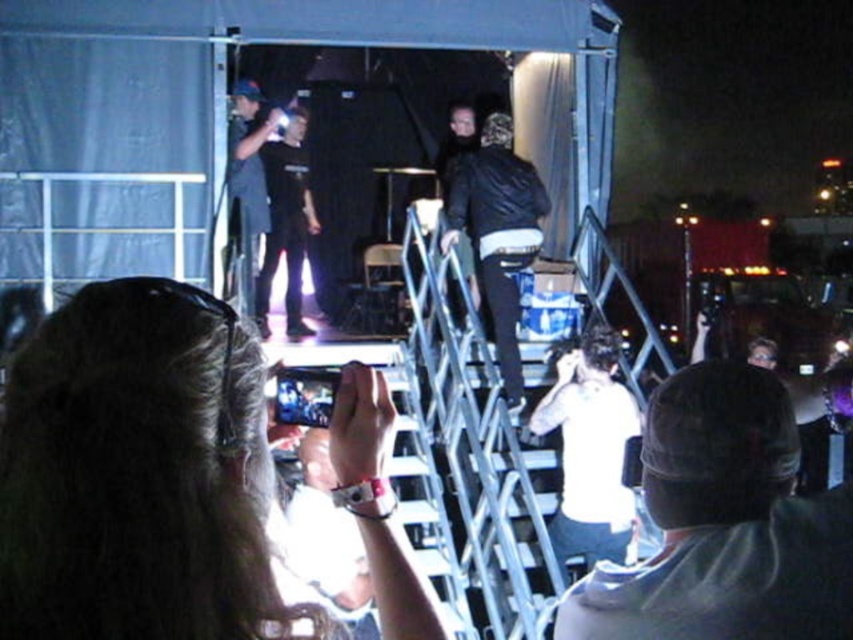
Question: Is gray fabric cap at upper right to the left of dark blue jeans at upper center from the viewer's perspective?

Choices:
 (A) no
 (B) yes

Answer: (A)

Question: Considering the real-world distances, which object is closest to the white matte shirt at center?

Choices:
 (A) dark blue jeans at upper center
 (B) silver metallic ladder at center
 (C) gray fabric cap at upper right
 (D) black leather jacket at center

Answer: (B)

Question: Where is silver metallic ladder at center located in relation to dark blue jeans at upper center in the image?

Choices:
 (A) left
 (B) right

Answer: (B)

Question: Is gray fabric cap at upper right below white matte shirt at center?

Choices:
 (A) no
 (B) yes

Answer: (A)

Question: Which object appears closest to the camera in this image?

Choices:
 (A) black leather jacket at center
 (B) dark blue jeans at upper center
 (C) white matte shirt at center

Answer: (C)

Question: Which object appears farthest from the camera in this image?

Choices:
 (A) dark blue jeans at upper center
 (B) silver metallic ladder at center
 (C) white matte shirt at center
 (D) black leather jacket at center

Answer: (A)